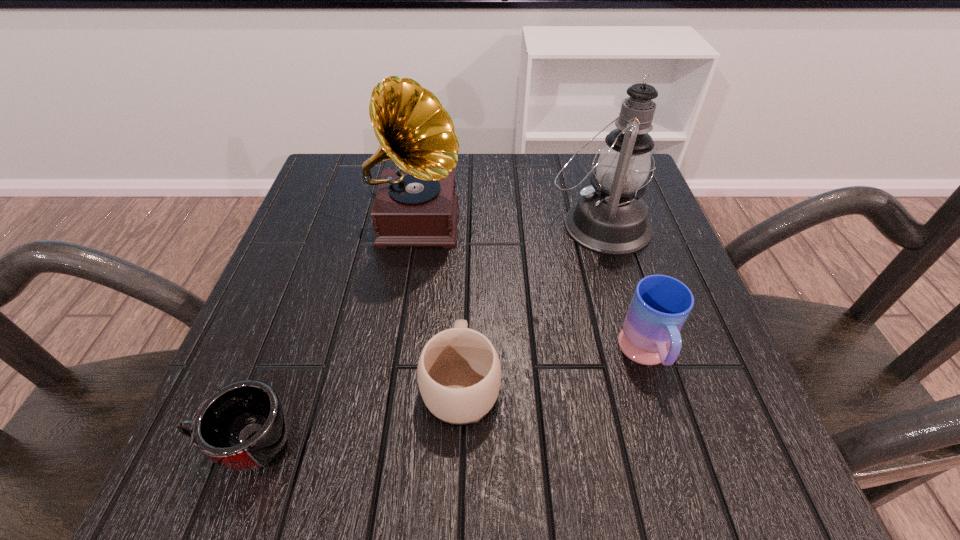
Image resolution: width=960 pixels, height=540 pixels. I want to click on oil lamp, so click(610, 218).

You are a GUI agent. You are given a task and a screenshot of the screen. Output one action in this format:
    pyautogui.click(x=<x>, y=<y>)
    Task: Click on the phonograph record
    The height and width of the screenshot is (540, 960).
    Given the screenshot: What is the action you would take?
    click(416, 205)

This screenshot has width=960, height=540. In order to click on the rightmost mug in this screenshot , I will do `click(660, 306)`.

Locate an element on the screen. the tallest mug is located at coordinates (660, 306).

Image resolution: width=960 pixels, height=540 pixels. Find the location of `the second mug from right to left`. the second mug from right to left is located at coordinates (459, 373).

Where is `the leftmost mug`? The image size is (960, 540). the leftmost mug is located at coordinates (243, 426).

Find the location of a particular element. vacant region located on the front of the oil lamp is located at coordinates (615, 277).

Identify the location of free space located 0.300m from the horn of the phonograph record. The width and height of the screenshot is (960, 540). (386, 411).

Locate an element on the screen. Image resolution: width=960 pixels, height=540 pixels. vacant space located on the side of the rightmost mug with the handle is located at coordinates (677, 454).

Image resolution: width=960 pixels, height=540 pixels. I want to click on blank area located 0.370m on the side of the second mug from left to right with the handle, so click(x=467, y=207).